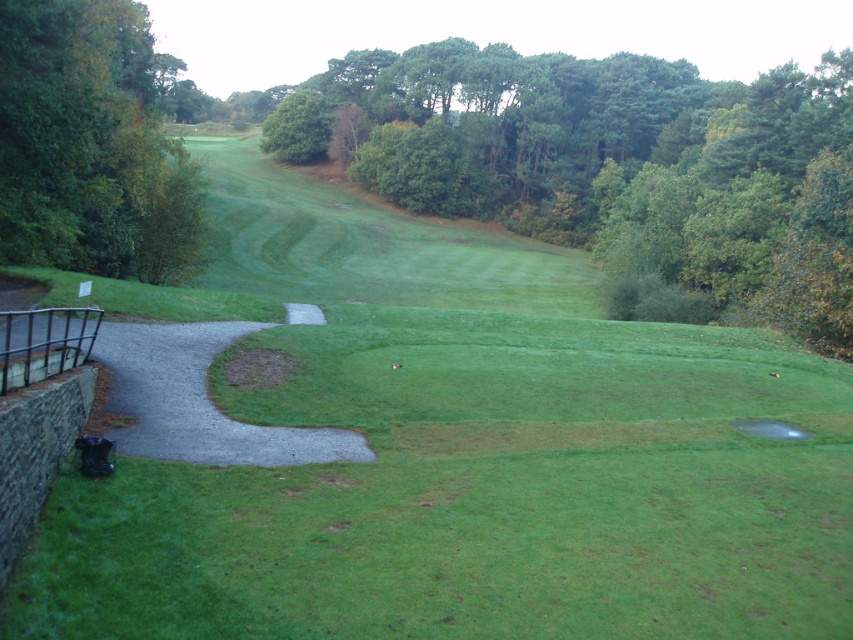
You are a golfer standing on the gray gravel path at left and want to hit the ball into the transparent plastic hole at center. Which direction should you aim to reach the hole?

The gray gravel path at left is closer to the viewer than the transparent plastic hole at center, so you should aim forward towards the transparent plastic hole at center to reach it.

You are standing on the golf course and want to walk from the point at coordinates (677, 234) to the point at (757, 419). Which direction should you move to get closer to your destination?

You should move away from the viewer because point (677, 234) is closer to the viewer than point (757, 419). Moving away from the viewer will take you towards the destination.

You are a golfer standing on the fairway and see the green leafy tree at left and the gray gravel path at left. Which object is above the other?

The green leafy tree at left is positioned over the gray gravel path at left, so the tree is above the path.